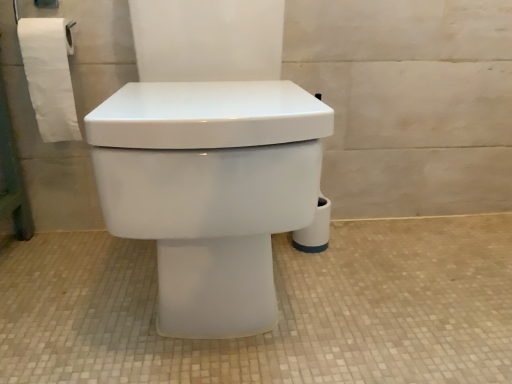
Identify the location of vacant space situated on the left part of white glossy toilet at center. Image resolution: width=512 pixels, height=384 pixels. (72, 283).